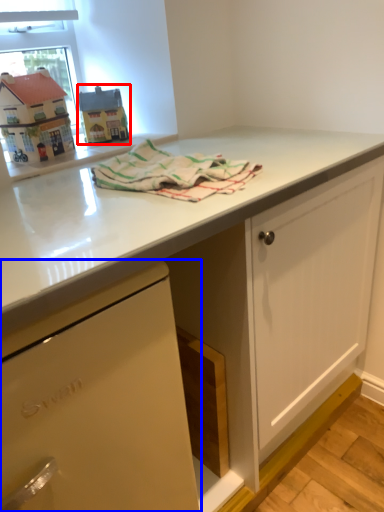
Question: Which object is further to the camera taking this photo, appliance (highlighted by a red box) or cabinetry (highlighted by a blue box)?

Choices:
 (A) appliance
 (B) cabinetry

Answer: (A)